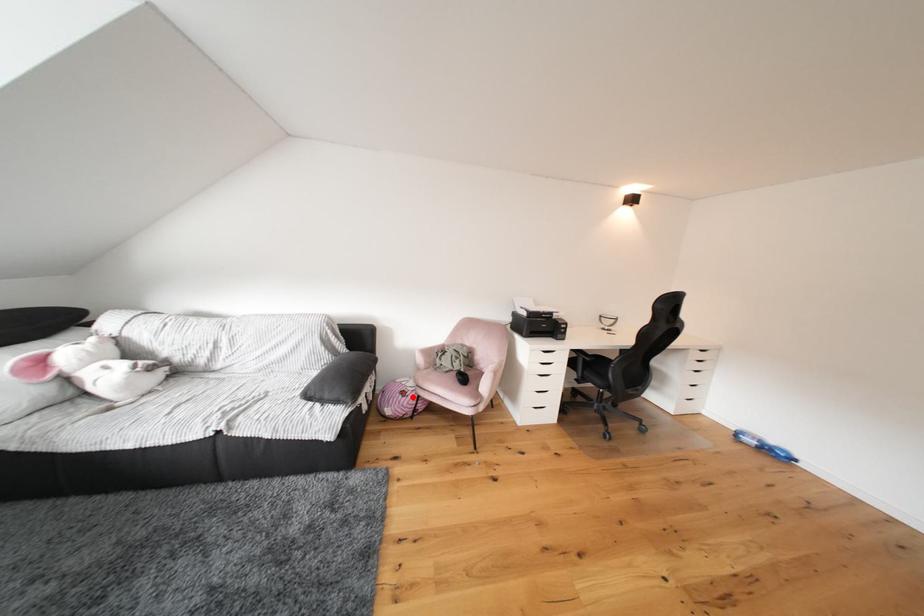
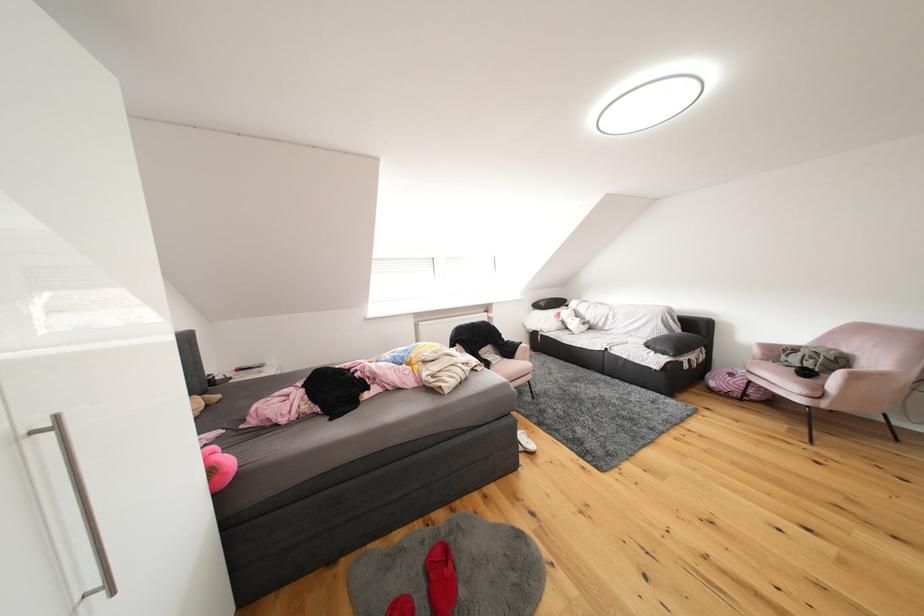
Find the pixel in the second image that matches the highlighted location in the first image.

(740, 379)